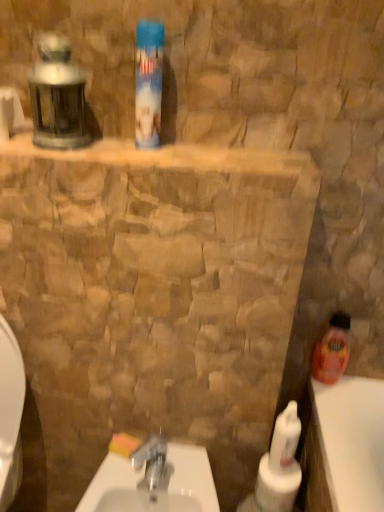
Find the location of `free location in front of yellow sponge at lower center`. free location in front of yellow sponge at lower center is located at coordinates (129, 480).